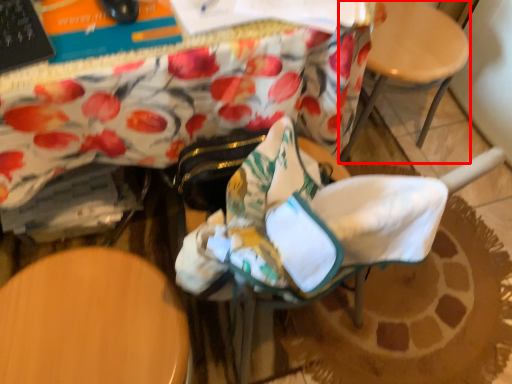
Question: Observing the image, what is the correct spatial positioning of chair (annotated by the red box) in reference to rocking chair?

Choices:
 (A) right
 (B) left

Answer: (A)